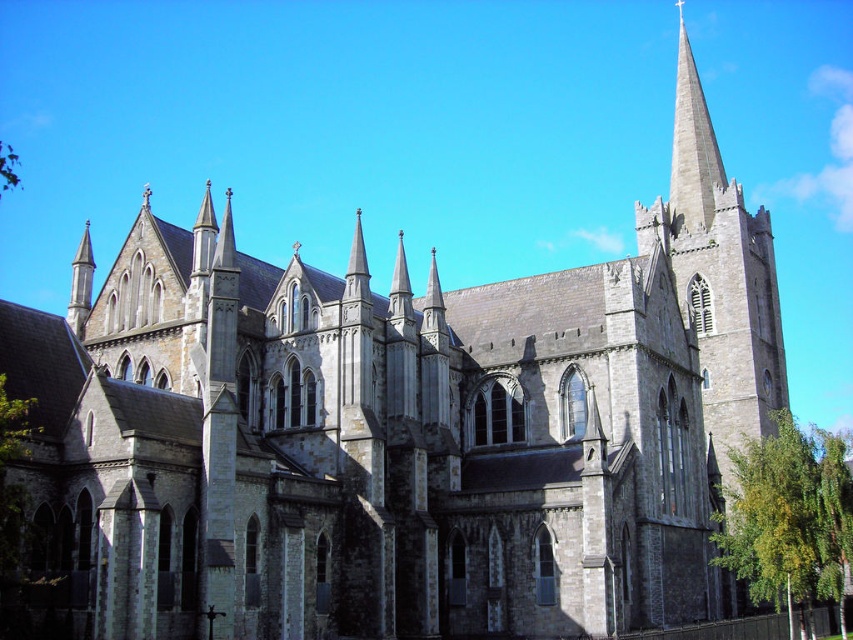
Question: Among these objects, which one is nearest to the camera?

Choices:
 (A) green leafy tree at lower right
 (B) gray stone spire at upper right

Answer: (A)

Question: Which point is farther to the camera?

Choices:
 (A) (677, 84)
 (B) (802, 563)

Answer: (A)

Question: Can you confirm if green leafy tree at lower right is positioned above gray stone spire at upper right?

Choices:
 (A) yes
 (B) no

Answer: (B)

Question: Is green leafy tree at lower right smaller than gray stone spire at upper right?

Choices:
 (A) no
 (B) yes

Answer: (B)

Question: Can you confirm if green leafy tree at lower right is positioned to the right of gray stone spire at upper right?

Choices:
 (A) yes
 (B) no

Answer: (B)